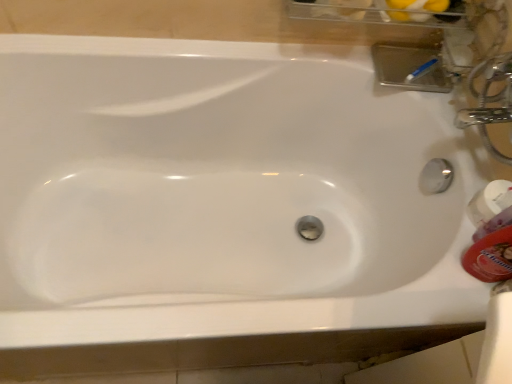
Image resolution: width=512 pixels, height=384 pixels. Describe the element at coordinates (490, 257) in the screenshot. I see `orange plastic mouthwash at right, acting as the second mouthwash starting from the back` at that location.

Find the location of a particular element. This screenshot has height=384, width=512. orange plastic mouthwash at right, the first mouthwash viewed from the front is located at coordinates (490, 257).

This screenshot has height=384, width=512. I want to click on white glossy mouthwash at right, acting as the second mouthwash starting from the front, so click(490, 208).

What do you see at coordinates (490, 208) in the screenshot? I see `white glossy mouthwash at right, the first mouthwash positioned from the back` at bounding box center [490, 208].

What is the approximate width of white glossy mouthwash at right, acting as the second mouthwash starting from the front?

white glossy mouthwash at right, acting as the second mouthwash starting from the front, is 9.44 centimeters in width.

Find the location of `orange plastic mouthwash at right, acting as the second mouthwash starting from the back`. orange plastic mouthwash at right, acting as the second mouthwash starting from the back is located at coordinates (490, 257).

Considering the relative positions of orange plastic mouthwash at right, the first mouthwash viewed from the front, and white glossy mouthwash at right, the first mouthwash positioned from the back, in the image provided, is orange plastic mouthwash at right, the first mouthwash viewed from the front, to the right of white glossy mouthwash at right, the first mouthwash positioned from the back, from the viewer's perspective?

Incorrect, orange plastic mouthwash at right, the first mouthwash viewed from the front, is not on the right side of white glossy mouthwash at right, the first mouthwash positioned from the back.

Which object is further away from the camera, orange plastic mouthwash at right, the first mouthwash viewed from the front, or white glossy mouthwash at right, the first mouthwash positioned from the back?

Positioned behind is white glossy mouthwash at right, the first mouthwash positioned from the back.

Considering the points (502, 248) and (511, 193), which point is behind, point (502, 248) or point (511, 193)?

Point (511, 193)

From the image's perspective, is orange plastic mouthwash at right, the first mouthwash viewed from the front, above or below white glossy mouthwash at right, acting as the second mouthwash starting from the front?

Based on their image positions, orange plastic mouthwash at right, the first mouthwash viewed from the front, is located beneath white glossy mouthwash at right, acting as the second mouthwash starting from the front.

From the picture: From a real-world perspective, relative to white glossy mouthwash at right, acting as the second mouthwash starting from the front, is orange plastic mouthwash at right, the first mouthwash viewed from the front, vertically above or below?

In terms of real-world spatial position, orange plastic mouthwash at right, the first mouthwash viewed from the front, is above white glossy mouthwash at right, acting as the second mouthwash starting from the front.

Considering the relative sizes of orange plastic mouthwash at right, the first mouthwash viewed from the front, and white glossy mouthwash at right, acting as the second mouthwash starting from the front, in the image provided, is orange plastic mouthwash at right, the first mouthwash viewed from the front, thinner than white glossy mouthwash at right, acting as the second mouthwash starting from the front,?

Yes, orange plastic mouthwash at right, the first mouthwash viewed from the front, is thinner than white glossy mouthwash at right, acting as the second mouthwash starting from the front.

Considering the relative sizes of orange plastic mouthwash at right, acting as the second mouthwash starting from the back, and white glossy mouthwash at right, the first mouthwash positioned from the back, in the image provided, is orange plastic mouthwash at right, acting as the second mouthwash starting from the back, taller than white glossy mouthwash at right, the first mouthwash positioned from the back,?

Yes, orange plastic mouthwash at right, acting as the second mouthwash starting from the back, is taller than white glossy mouthwash at right, the first mouthwash positioned from the back.

Who is smaller, orange plastic mouthwash at right, the first mouthwash viewed from the front, or white glossy mouthwash at right, acting as the second mouthwash starting from the front?

With smaller size is white glossy mouthwash at right, acting as the second mouthwash starting from the front.

Do you think orange plastic mouthwash at right, the first mouthwash viewed from the front, is within white glossy mouthwash at right, acting as the second mouthwash starting from the front, or outside of it?

The correct answer is: outside.

In the scene shown: Is orange plastic mouthwash at right, the first mouthwash viewed from the front, beside white glossy mouthwash at right, the first mouthwash positioned from the back?

Yes, orange plastic mouthwash at right, the first mouthwash viewed from the front, is with white glossy mouthwash at right, the first mouthwash positioned from the back.

Looking at this image, is orange plastic mouthwash at right, the first mouthwash viewed from the front, oriented towards white glossy mouthwash at right, acting as the second mouthwash starting from the front?

No, orange plastic mouthwash at right, the first mouthwash viewed from the front, is not aimed at white glossy mouthwash at right, acting as the second mouthwash starting from the front.

How distant is orange plastic mouthwash at right, acting as the second mouthwash starting from the back, from white glossy mouthwash at right, acting as the second mouthwash starting from the front?

They are 2.84 inches apart.

Locate an element on the screen. Image resolution: width=512 pixels, height=384 pixels. mouthwash above the white glossy mouthwash at right, acting as the second mouthwash starting from the front (from a real-world perspective) is located at coordinates (490, 257).

Can you confirm if white glossy mouthwash at right, the first mouthwash positioned from the back, is positioned to the left of orange plastic mouthwash at right, acting as the second mouthwash starting from the back?

Incorrect, white glossy mouthwash at right, the first mouthwash positioned from the back, is not on the left side of orange plastic mouthwash at right, acting as the second mouthwash starting from the back.

Which object is further away from the camera, white glossy mouthwash at right, the first mouthwash positioned from the back, or orange plastic mouthwash at right, the first mouthwash viewed from the front?

Positioned behind is white glossy mouthwash at right, the first mouthwash positioned from the back.

Which point is more forward, (502, 213) or (509, 237)?

The point (509, 237) is more forward.

Looking at this image, from the image's perspective, who appears lower, white glossy mouthwash at right, the first mouthwash positioned from the back, or orange plastic mouthwash at right, the first mouthwash viewed from the front?

orange plastic mouthwash at right, the first mouthwash viewed from the front, appears lower in the image.

From a real-world perspective, which object rests below the other?

white glossy mouthwash at right, acting as the second mouthwash starting from the front, is physically lower.

Based on the photo, which of these two, white glossy mouthwash at right, the first mouthwash positioned from the back, or orange plastic mouthwash at right, the first mouthwash viewed from the front, is wider?

white glossy mouthwash at right, the first mouthwash positioned from the back, is wider.

Who is taller, white glossy mouthwash at right, acting as the second mouthwash starting from the front, or orange plastic mouthwash at right, the first mouthwash viewed from the front?

orange plastic mouthwash at right, the first mouthwash viewed from the front, is taller.

Looking at this image, can you confirm if white glossy mouthwash at right, the first mouthwash positioned from the back, is bigger than orange plastic mouthwash at right, acting as the second mouthwash starting from the back?

No, white glossy mouthwash at right, the first mouthwash positioned from the back, is not bigger than orange plastic mouthwash at right, acting as the second mouthwash starting from the back.

Is orange plastic mouthwash at right, the first mouthwash viewed from the front, inside white glossy mouthwash at right, acting as the second mouthwash starting from the front?

That's incorrect, orange plastic mouthwash at right, the first mouthwash viewed from the front, is not inside white glossy mouthwash at right, acting as the second mouthwash starting from the front.

Is white glossy mouthwash at right, acting as the second mouthwash starting from the front, directly adjacent to orange plastic mouthwash at right, acting as the second mouthwash starting from the back?

Yes, white glossy mouthwash at right, acting as the second mouthwash starting from the front, is next to orange plastic mouthwash at right, acting as the second mouthwash starting from the back.

Is orange plastic mouthwash at right, the first mouthwash viewed from the front, at the back of white glossy mouthwash at right, the first mouthwash positioned from the back?

No.

How many degrees apart are the facing directions of white glossy mouthwash at right, acting as the second mouthwash starting from the front, and orange plastic mouthwash at right, the first mouthwash viewed from the front?

The angle between the facing direction of white glossy mouthwash at right, acting as the second mouthwash starting from the front, and the facing direction of orange plastic mouthwash at right, the first mouthwash viewed from the front, is 39.3 degrees.

You are a GUI agent. You are given a task and a screenshot of the screen. Output one action in this format:
    pyautogui.click(x=<x>, y=<y>)
    Task: Click on the mouthwash on the left of the white glossy mouthwash at right, acting as the second mouthwash starting from the front
    This screenshot has width=512, height=384.
    Given the screenshot: What is the action you would take?
    pyautogui.click(x=490, y=257)

At what (x,y) coordinates should I click in order to perform the action: click on mouthwash above the white glossy mouthwash at right, acting as the second mouthwash starting from the front (from a real-world perspective). Please return your answer as a coordinate pair (x, y). This screenshot has width=512, height=384. Looking at the image, I should click on (490, 257).

Where is `mouthwash on the left of white glossy mouthwash at right, the first mouthwash positioned from the back`? The width and height of the screenshot is (512, 384). mouthwash on the left of white glossy mouthwash at right, the first mouthwash positioned from the back is located at coordinates (490, 257).